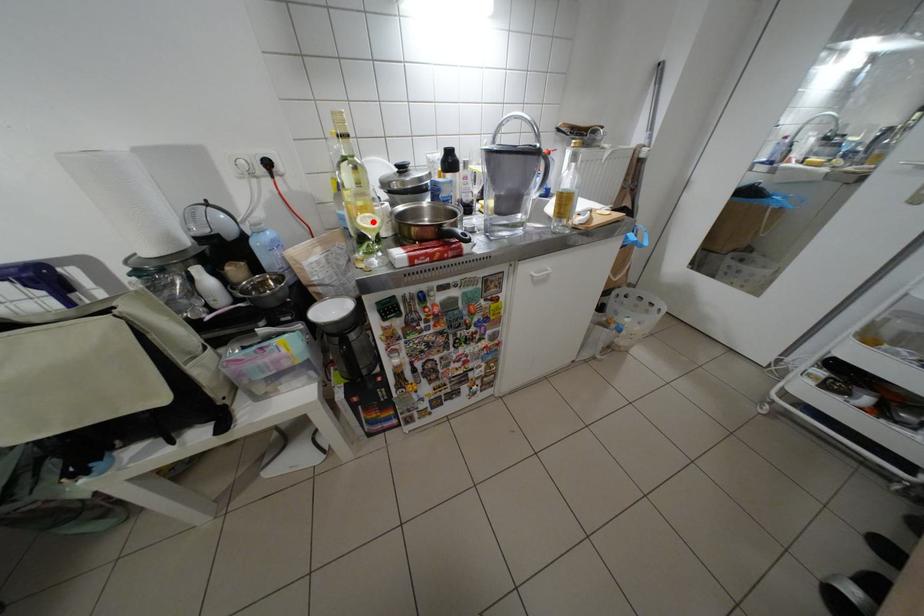
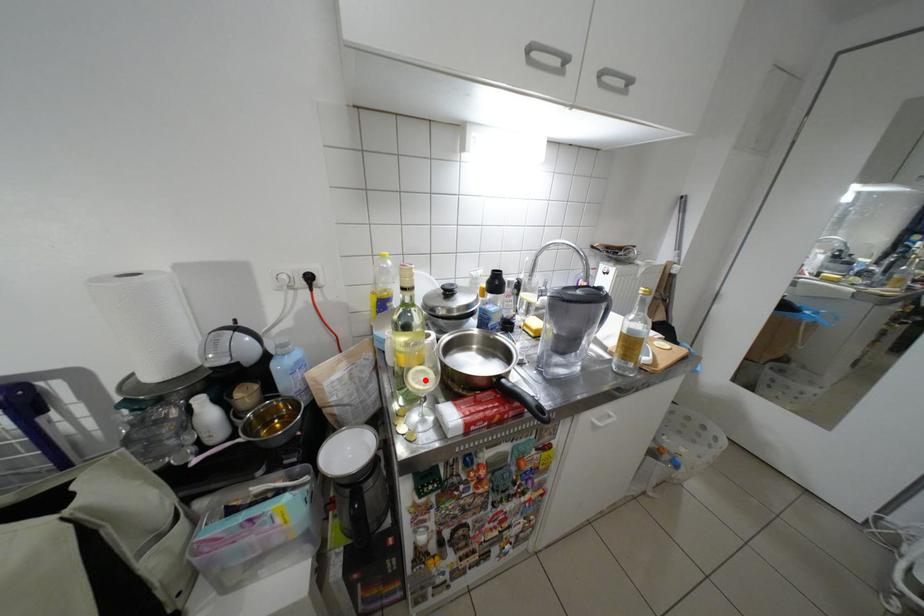
I am providing you with two images of the same scene from different viewpoints. A red point is marked on the first image and another point is marked on the second image. Do the highlighted points in image1 and image2 indicate the same real-world spot?

Yes